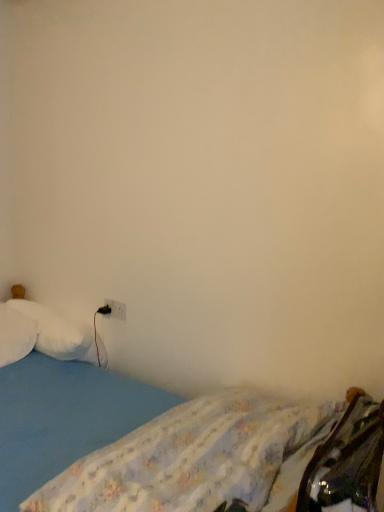
Question: Considering their positions, is white fluffy pillow at left, which is counted as the 2th pillow, starting from the right, located in front of or behind blue fabric bed at lower left?

Choices:
 (A) front
 (B) behind

Answer: (B)

Question: Is white fluffy pillow at left, which ranks as the 1th pillow in left-to-right order, spatially inside blue fabric bed at lower left, or outside of it?

Choices:
 (A) outside
 (B) inside

Answer: (B)

Question: Estimate the real-world distances between objects in this image. Which object is closer to the blue fabric mattress at lower left?

Choices:
 (A) blue fabric bed at lower left
 (B) white plastic electric outlet at lower left
 (C) white soft pillow at left, placed as the first pillow when sorted from right to left
 (D) white fluffy pillow at left, which ranks as the 1th pillow in left-to-right order

Answer: (A)

Question: Which object is positioned closest to the white soft pillow at left, placed as the 2th pillow when sorted from left to right?

Choices:
 (A) blue fabric mattress at lower left
 (B) blue fabric bed at lower left
 (C) white fluffy pillow at left, which is counted as the 2th pillow, starting from the right
 (D) white plastic electric outlet at lower left

Answer: (C)